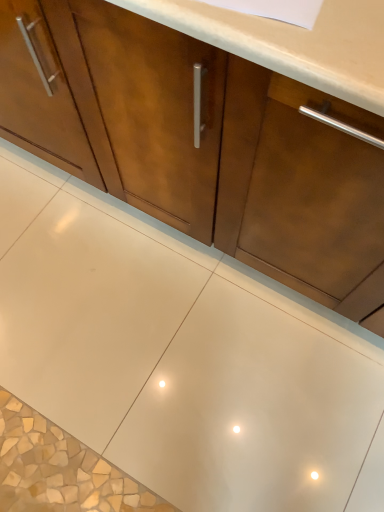
Image resolution: width=384 pixels, height=512 pixels. What do you see at coordinates (203, 144) in the screenshot?
I see `matte wood cabinet at center` at bounding box center [203, 144].

Where is `matte wood cabinet at center`? The height and width of the screenshot is (512, 384). matte wood cabinet at center is located at coordinates (203, 144).

Image resolution: width=384 pixels, height=512 pixels. Identify the location of matte wood cabinet at center. (203, 144).